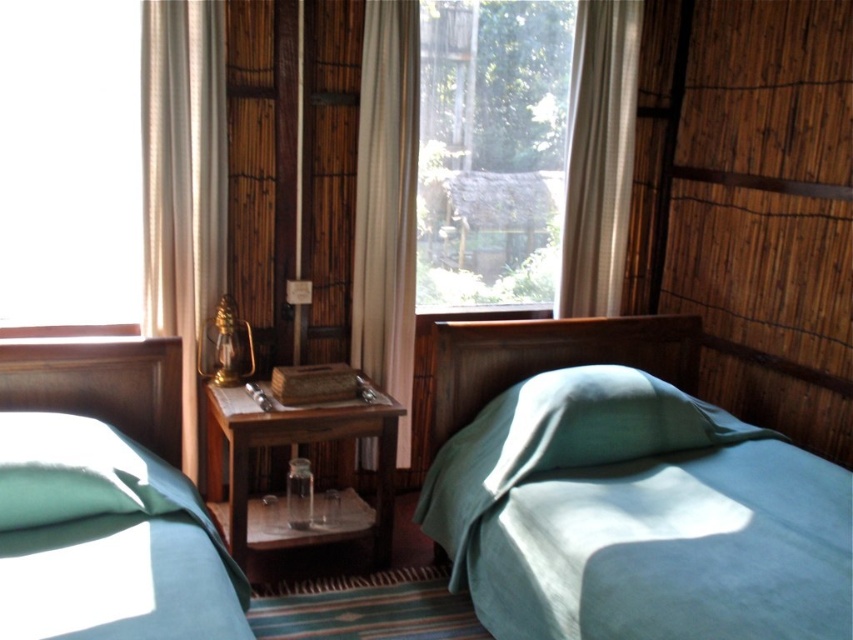
You are an interior designer planning to place a 10 cm thick decorative shelf between the transparent glass window at upper left and the matte green fabric bed at left. Will the shelf fit horizontally between them?

The transparent glass window at upper left is thinner than the matte green fabric bed at left, so the 10 cm thick decorative shelf may not fit horizontally between them as the space might be narrower than required.

You are standing in the middle of the bedroom and want to look outside through the transparent glass window at center. However, there is a matte green pillow at lower left in the way. Can you see through the window without moving the pillow?

The transparent glass window at center has a greater height compared to the matte green pillow at lower left, so yes, you can see through the transparent glass window at center without moving the matte green pillow at lower left because it is taller.

You are standing at the point marked as point [190,460] in a rustic bedroom. You want to place a small potted plant on the floor. If the plant requires 0.5 meters of space around it to grow properly, is there enough space at your current position?

The distance between you and the viewer is 2.90 meters, but the required space for the plant is 0.5 meters. Since the plant only needs 0.5 meters of space, there is sufficient room at your current position to place it.